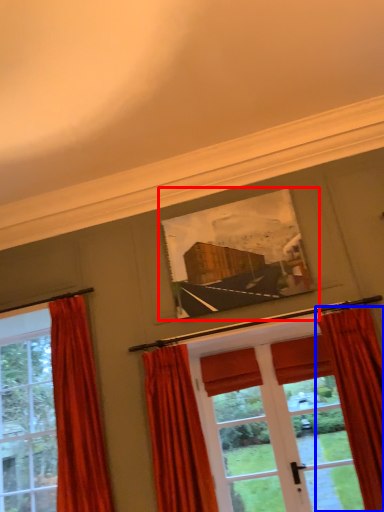
Question: Which of the following is the closest to the observer, picture frame (highlighted by a red box) or curtain (highlighted by a blue box)?

Choices:
 (A) picture frame
 (B) curtain

Answer: (B)